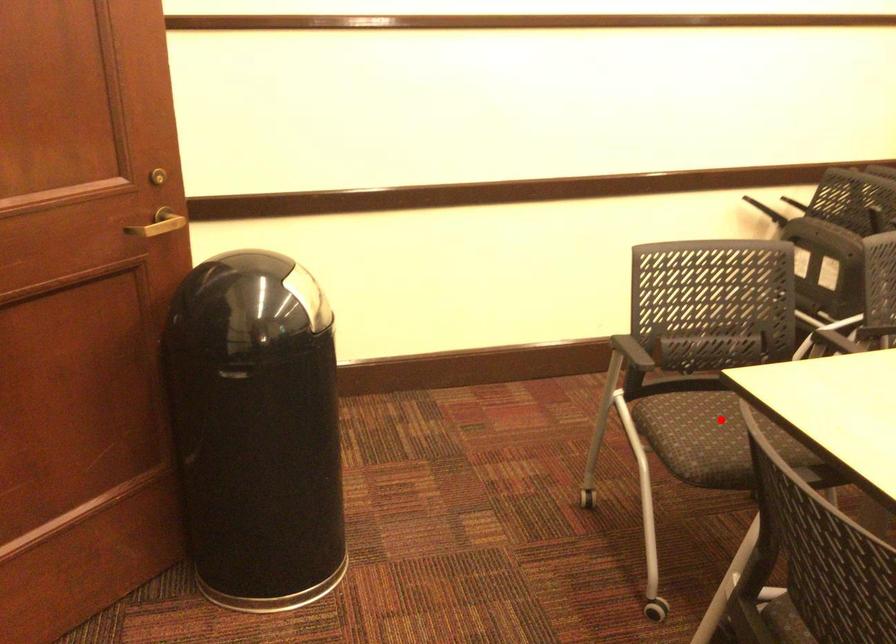
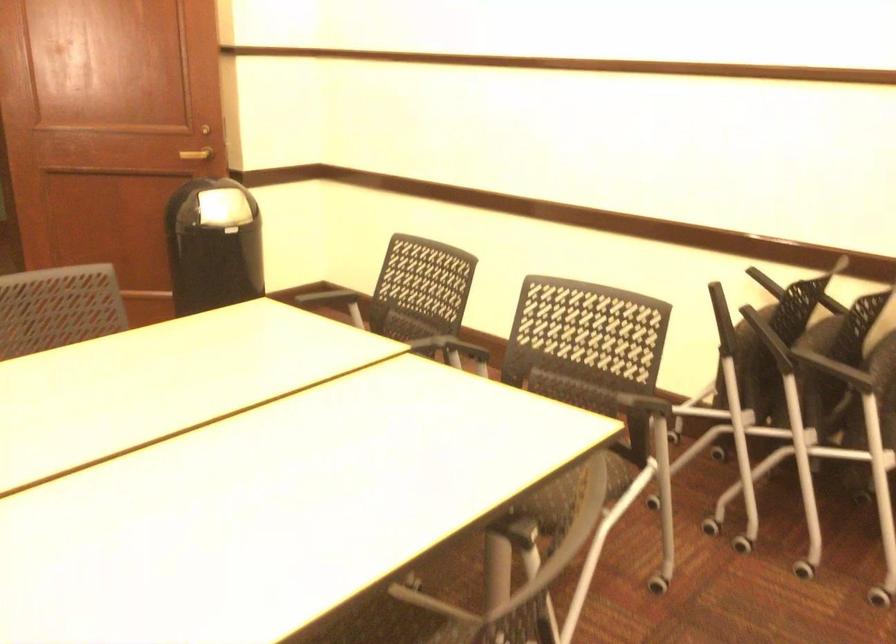
Question: I am providing you with two images of the same scene from different viewpoints. A red point is marked on the first image. Is the red point's position out of view in image 2?

Choices:
 (A) Yes
 (B) No

Answer: (A)